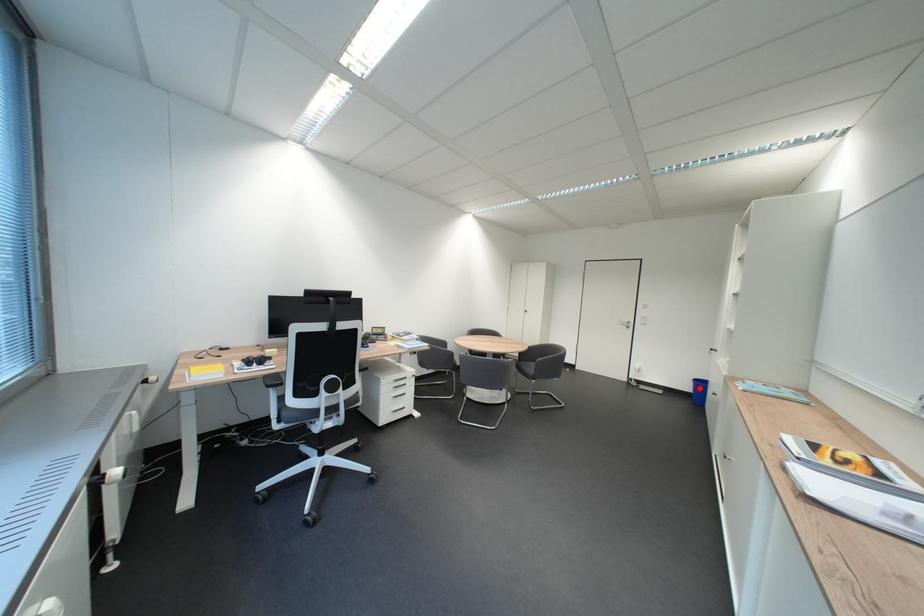
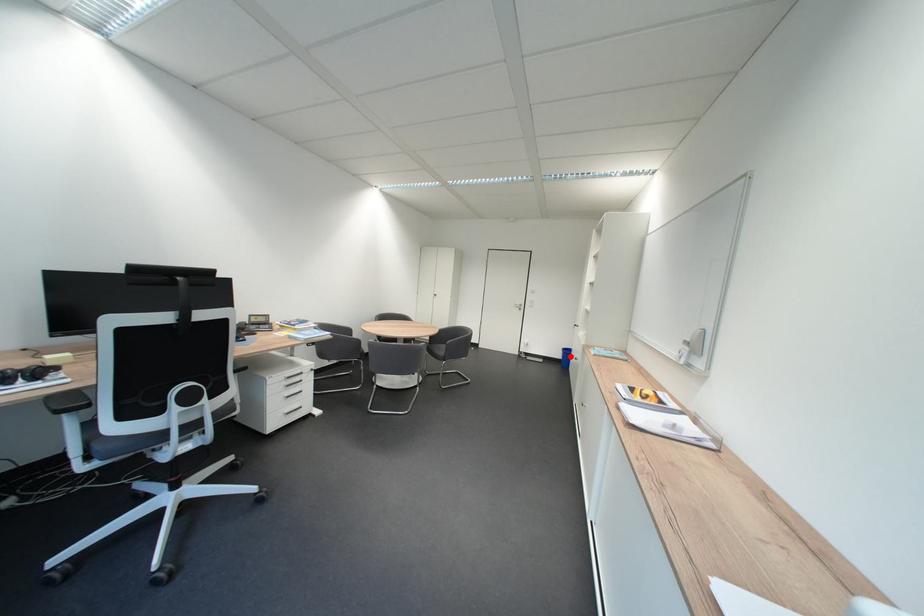
I am providing you with two images of the same scene from different viewpoints. A red point is marked on the first image and another point is marked on the second image. Are the points marked in image1 and image2 representing the same 3D position?

Yes